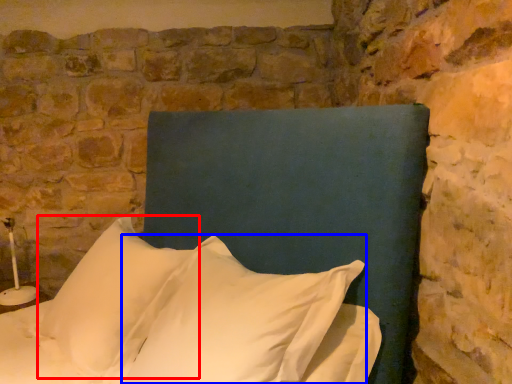
Question: Among these objects, which one is nearest to the camera, pillow (highlighted by a red box) or pillow (highlighted by a blue box)?

Choices:
 (A) pillow
 (B) pillow

Answer: (B)